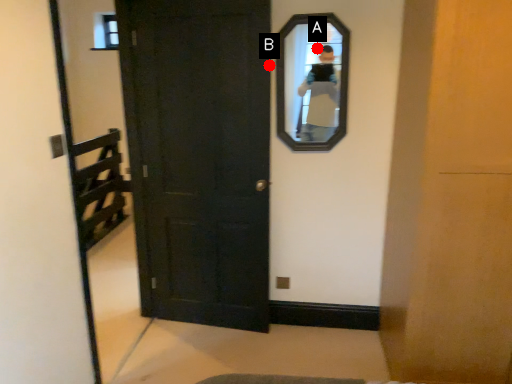
Question: Two points are circled on the image, labeled by A and B beside each circle. Among these points, which one is nearest to the camera?

Choices:
 (A) A is closer
 (B) B is closer

Answer: (B)